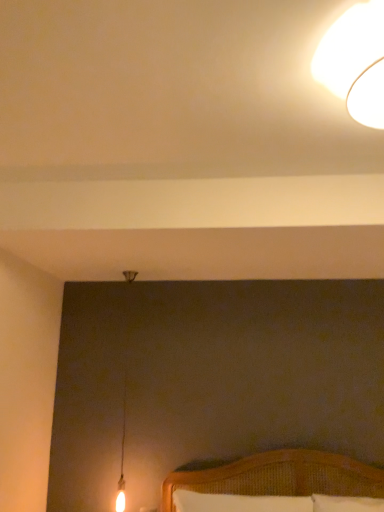
Question: Is white woven pillow at lower center looking in the opposite direction of white glossy lampshade at upper right?

Choices:
 (A) no
 (B) yes

Answer: (A)

Question: Is white woven pillow at lower center positioned in front of white glossy lampshade at upper right?

Choices:
 (A) no
 (B) yes

Answer: (A)

Question: Does white woven pillow at lower center contain white glossy lampshade at upper right?

Choices:
 (A) yes
 (B) no

Answer: (B)

Question: From the image's perspective, is white woven pillow at lower center located above white glossy lampshade at upper right?

Choices:
 (A) yes
 (B) no

Answer: (B)

Question: Is white woven pillow at lower center taller than white glossy lampshade at upper right?

Choices:
 (A) no
 (B) yes

Answer: (B)

Question: Is white woven pillow at lower center located outside white glossy lampshade at upper right?

Choices:
 (A) yes
 (B) no

Answer: (A)

Question: Is white glossy lampshade at upper right at the right side of white woven pillow at lower center?

Choices:
 (A) no
 (B) yes

Answer: (B)

Question: Does white glossy lampshade at upper right contain white woven pillow at lower center?

Choices:
 (A) no
 (B) yes

Answer: (A)

Question: Are white glossy lampshade at upper right and white woven pillow at lower center making contact?

Choices:
 (A) yes
 (B) no

Answer: (B)

Question: Is white glossy lampshade at upper right shorter than white woven pillow at lower center?

Choices:
 (A) no
 (B) yes

Answer: (B)

Question: Considering the relative sizes of white glossy lampshade at upper right and white woven pillow at lower center in the image provided, is white glossy lampshade at upper right smaller than white woven pillow at lower center?

Choices:
 (A) yes
 (B) no

Answer: (A)

Question: Is white woven pillow at lower center at the back of white glossy lampshade at upper right?

Choices:
 (A) yes
 (B) no

Answer: (B)

Question: In terms of height, does white glossy lampshade at upper right look taller or shorter compared to white woven pillow at lower center?

Choices:
 (A) short
 (B) tall

Answer: (A)